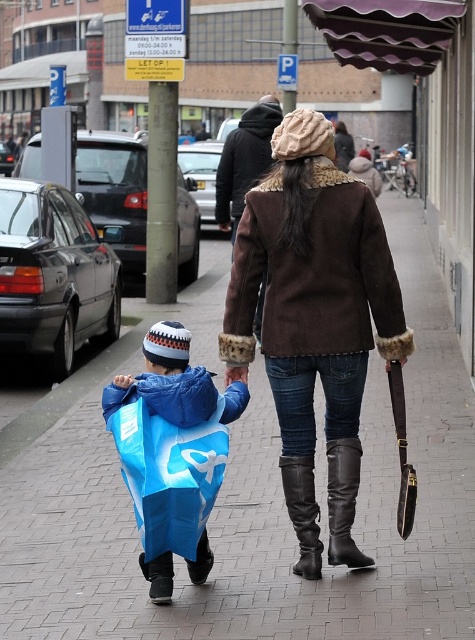
Can you confirm if blue fabric bag at lower left is positioned to the right of black leather boot at lower center?

No, blue fabric bag at lower left is not to the right of black leather boot at lower center.

Which is below, blue fabric bag at lower left or black leather boot at lower center?

black leather boot at lower center is below.

Is point (234, 384) less distant than point (311, 468)?

Yes, it is.

Identify the location of blue fabric bag at lower left. [165, 380].

Between brick pavement at center and black leather boot at lower center, which one appears on the right side from the viewer's perspective?

Positioned to the right is black leather boot at lower center.

Who is more distant from viewer, (420, 568) or (305, 474)?

The point (420, 568) is behind.

Who is more forward, [262,592] or [312,512]?

Positioned in front is point [262,592].

Find the location of a particular element. Image resolution: width=475 pixels, height=640 pixels. brick pavement at center is located at coordinates tap(249, 496).

Based on the photo, is brick pavement at center taller than blue fabric bag at lower left?

Yes.

Is point (368, 529) positioned in front of point (161, 358)?

That is False.

Find the location of a particular element. brick pavement at center is located at coordinates (249, 496).